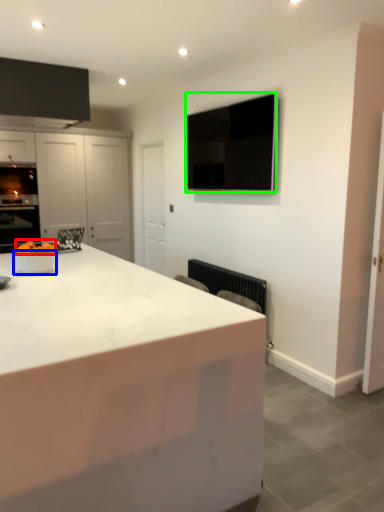
Question: Based on their relative distances, which object is nearer to fruit (highlighted by a red box)? Choose from bowl (highlighted by a blue box) and appliance (highlighted by a green box).

Choices:
 (A) bowl
 (B) appliance

Answer: (A)